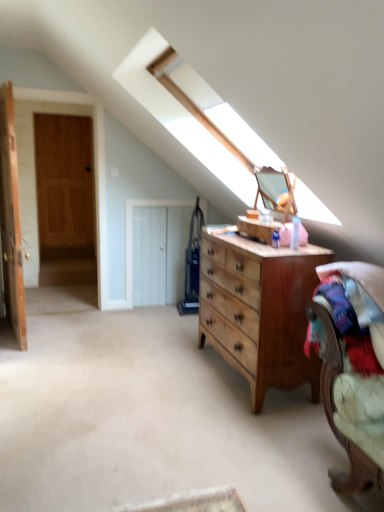
Question: Which is correct: velvet-like beige armchair at lower right is inside white wooden door at center, positioned as the 3th door in left-to-right order, or outside of it?

Choices:
 (A) outside
 (B) inside

Answer: (A)

Question: From a real-world perspective, relative to white wooden door at center, positioned as the 3th door in left-to-right order, is velvet-like beige armchair at lower right vertically above or below?

Choices:
 (A) below
 (B) above

Answer: (B)

Question: Estimate the real-world distances between objects in this image. Which object is closer to the wooden door at left, which appears as the 2th door when viewed from the right?

Choices:
 (A) velvet-like beige armchair at lower right
 (B) wooden door at left, which ranks as the 3th door in right-to-left order
 (C) wooden dresser at center
 (D) white wooden door at center, positioned as the 3th door in left-to-right order

Answer: (D)

Question: Estimate the real-world distances between objects in this image. Which object is farther from the white wooden door at center, which appears as the 1th door when viewed from the right?

Choices:
 (A) velvet-like beige armchair at lower right
 (B) wooden door at left, which appears as the 2th door when viewed from the right
 (C) wooden dresser at center
 (D) wooden door at left, placed as the first door when sorted from left to right

Answer: (A)